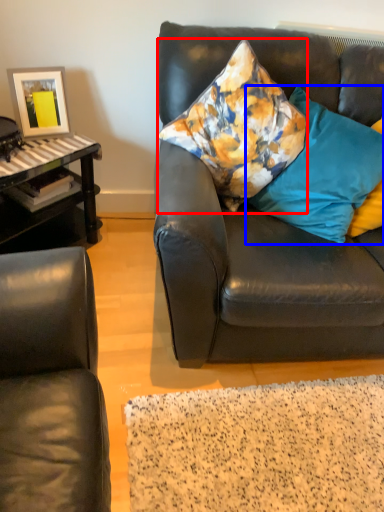
Question: Which of the following is the farthest to the observer, pillow (highlighted by a red box) or pillow (highlighted by a blue box)?

Choices:
 (A) pillow
 (B) pillow

Answer: (B)